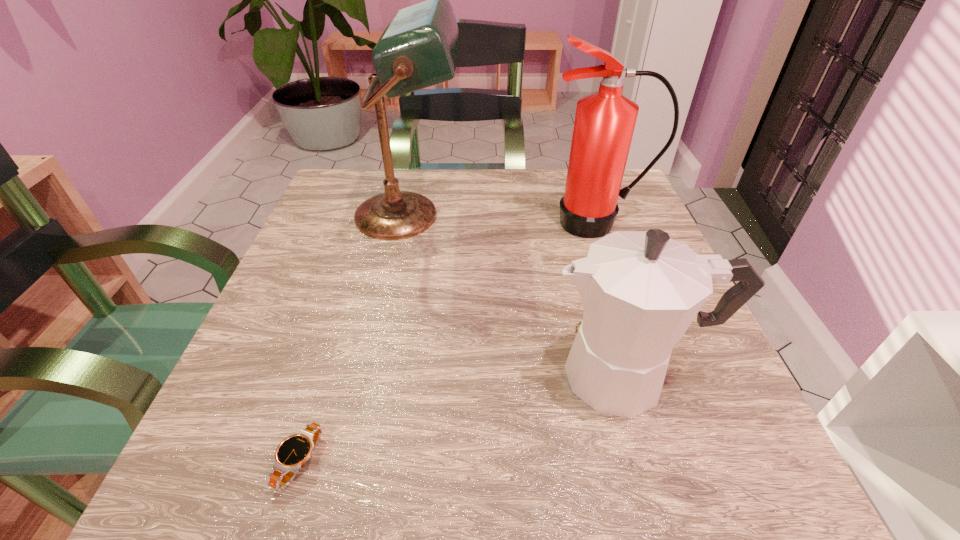
You are a GUI agent. You are given a task and a screenshot of the screen. Output one action in this format:
    pyautogui.click(x=<x>, y=<y>)
    Task: Click on the free space in the image that satisfies the following two spatial constraints: 1. at the spray nozzle of the fire extinguisher; 2. at the spout of the third tallest object
    
    Given the screenshot: What is the action you would take?
    pyautogui.click(x=649, y=375)

Locate an element on the screen. The height and width of the screenshot is (540, 960). vacant area that satisfies the following two spatial constraints: 1. at the spout of the second nearest object; 2. on the front side of the shortest object is located at coordinates (654, 462).

The width and height of the screenshot is (960, 540). In order to click on vacant point that satisfies the following two spatial constraints: 1. at the spray nozzle of the fire extinguisher; 2. at the spout of the second shortest object in this screenshot , I will do `click(649, 375)`.